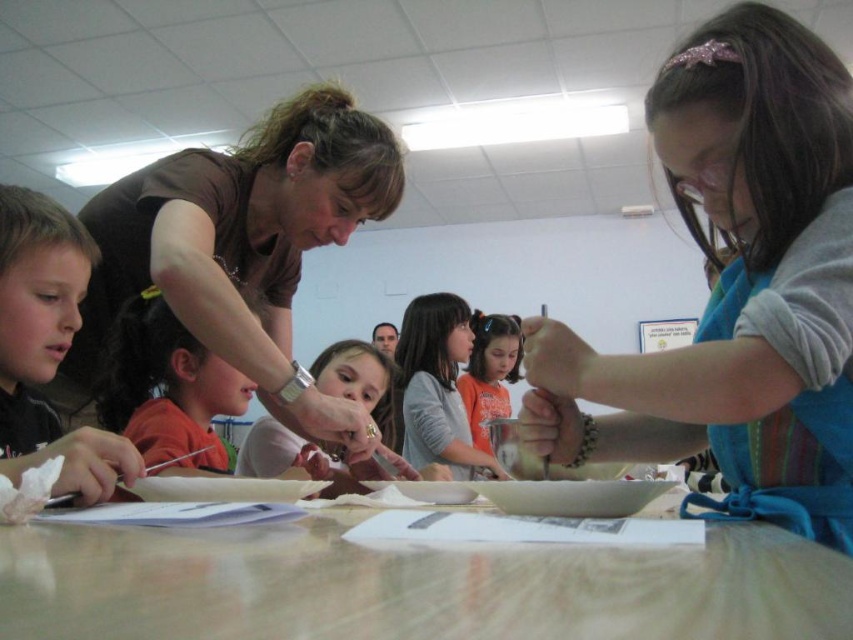
Question: Estimate the real-world distances between objects in this image. Which object is farther from the smooth wooden table at center?

Choices:
 (A) blue apron at center
 (B) orange cotton shirt at center
 (C) brown matte shirt at upper left
 (D) orange shirt at center

Answer: (B)

Question: Which point appears closest to the camera in this image?

Choices:
 (A) coord(32,193)
 (B) coord(10,577)
 (C) coord(474,422)
 (D) coord(473,438)

Answer: (B)

Question: Is orange shirt at center positioned in front of orange cotton shirt at center?

Choices:
 (A) yes
 (B) no

Answer: (A)

Question: Is light brown hair at left to the left of orange shirt at center from the viewer's perspective?

Choices:
 (A) no
 (B) yes

Answer: (A)

Question: Is blue apron at center bigger than smooth wooden table at center?

Choices:
 (A) no
 (B) yes

Answer: (B)

Question: Which object is positioned farthest from the light brown hair at left?

Choices:
 (A) brown matte shirt at upper left
 (B) orange cotton shirt at center
 (C) smooth wooden table at center

Answer: (B)